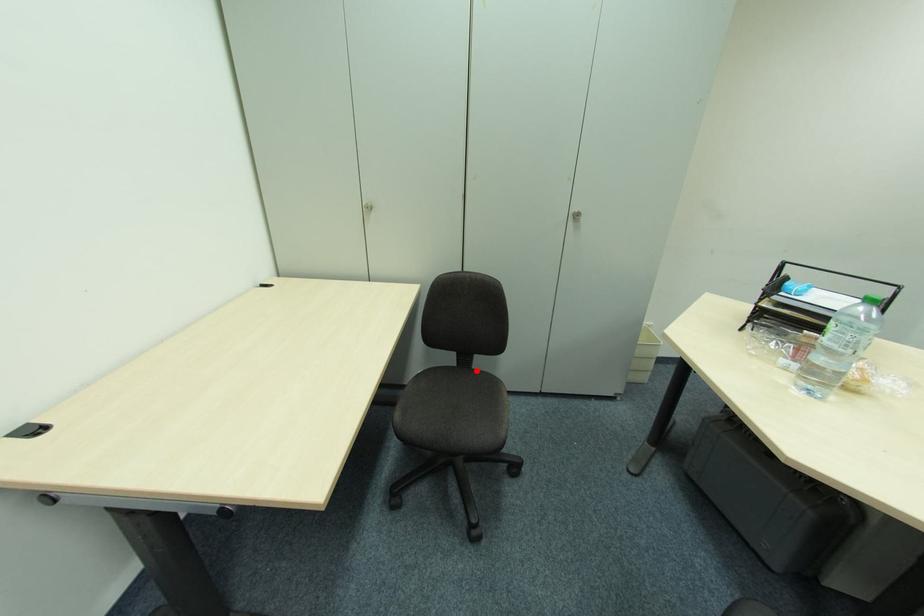
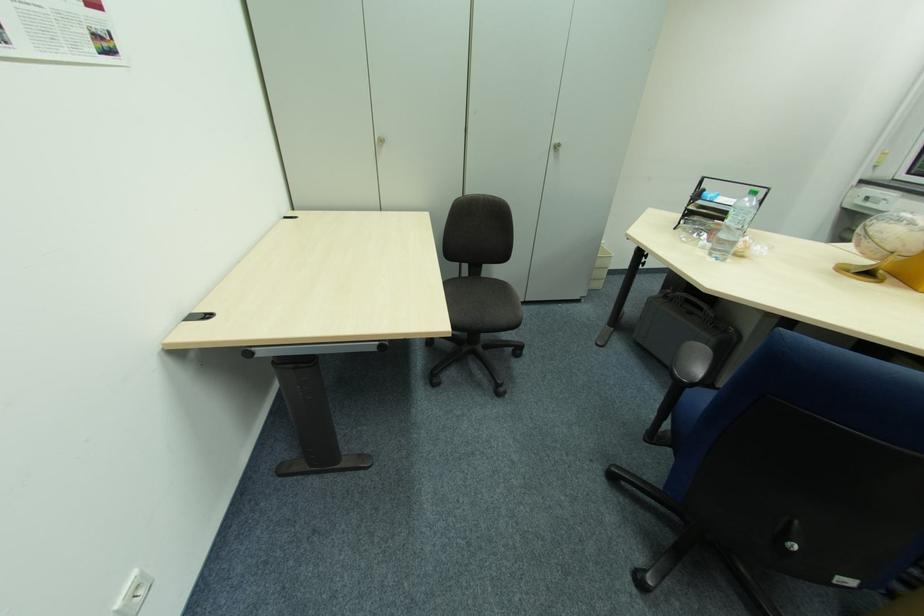
Find the pixel in the second image that matches the highlighted location in the first image.

(485, 278)